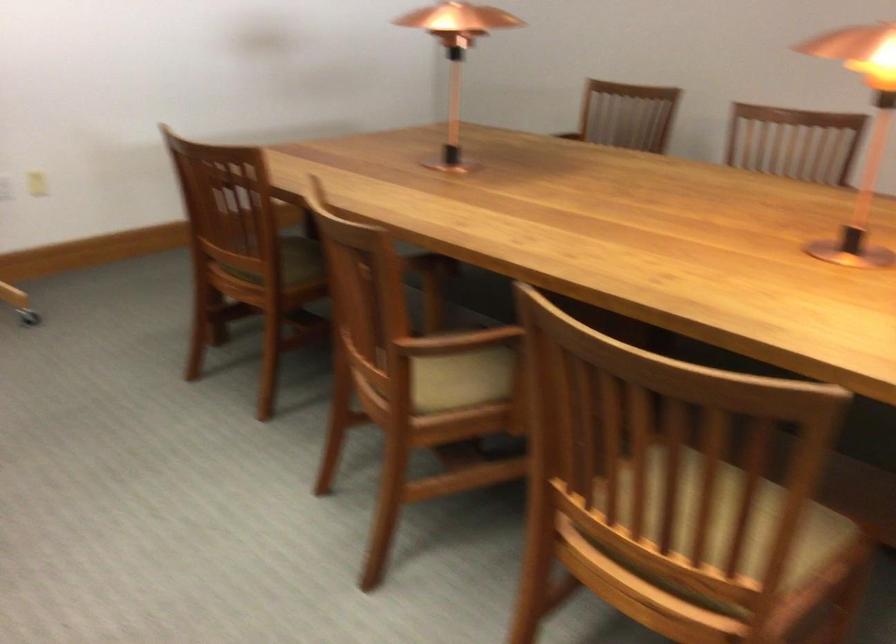
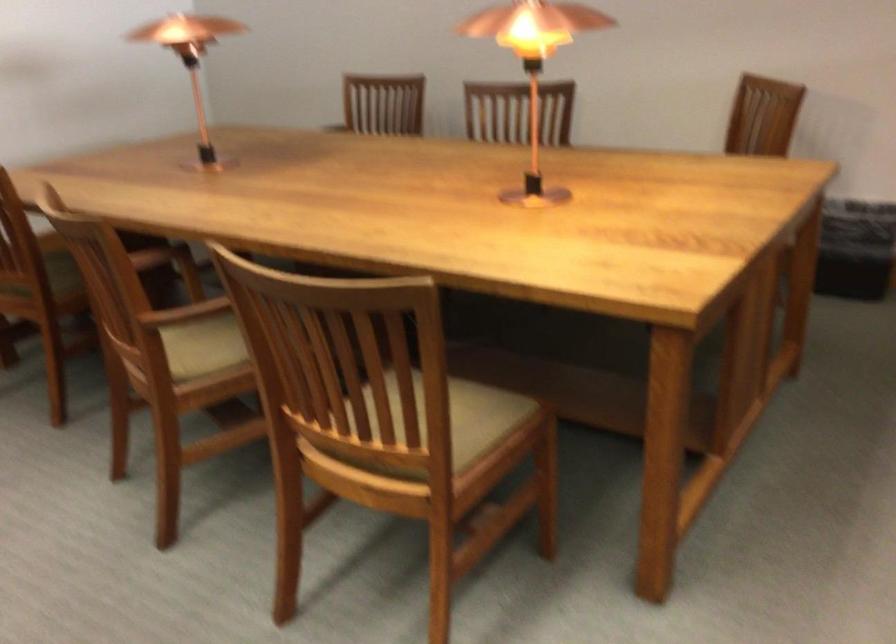
Question: The images are taken continuously from a first-person perspective. In which direction is your viewpoint rotating?

Choices:
 (A) Left
 (B) Right
 (C) Up
 (D) Down

Answer: (B)